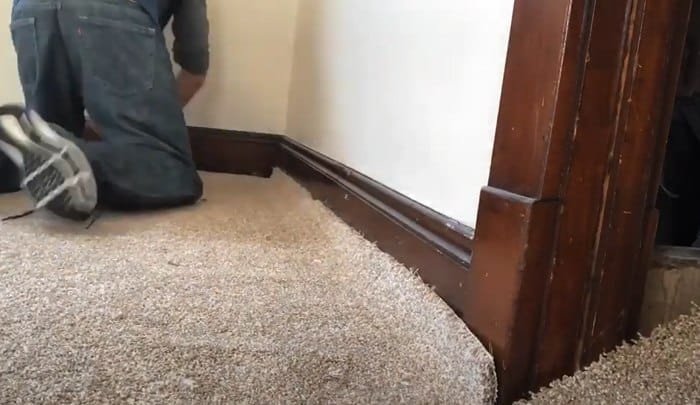
At what (x,y) coordinates should I click in order to perform the action: click on loose carpet edge'. Please return your answer as a coordinate pair (x, y). The image size is (700, 405). Looking at the image, I should click on (490, 361), (126, 44), (29, 41).